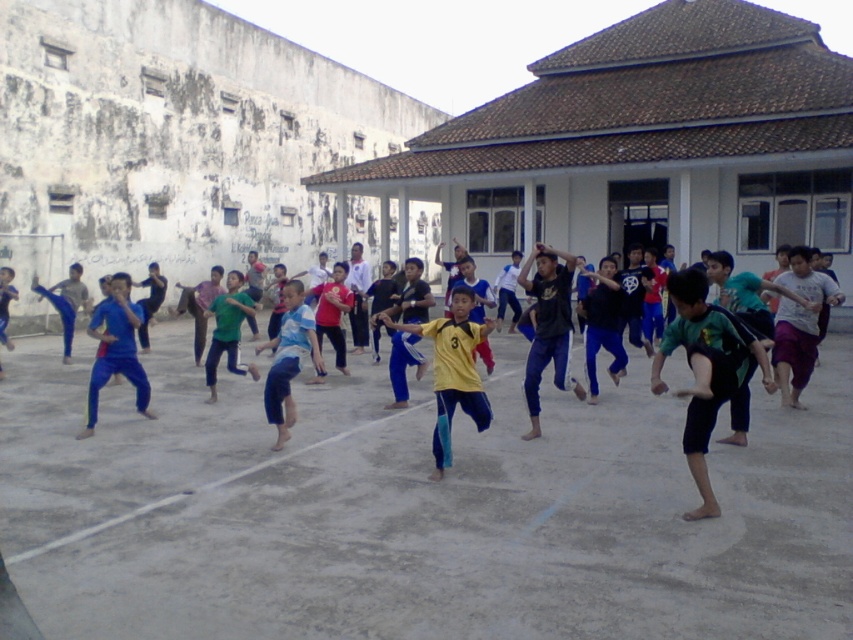
Question: Estimate the real-world distances between objects in this image. Which object is closer to the green fabric pants at center?

Choices:
 (A) blue fabric pants at center
 (B) yellow jersey at center

Answer: (A)

Question: Which is nearer to the green fabric pants at center?

Choices:
 (A) yellow jersey at center
 (B) blue fabric pants at center

Answer: (B)

Question: Is yellow jersey at center in front of blue fabric pants at center?

Choices:
 (A) yes
 (B) no

Answer: (A)

Question: Is blue fabric pants at center further to camera compared to green fabric pants at center?

Choices:
 (A) no
 (B) yes

Answer: (A)

Question: Can you confirm if yellow jersey at center is positioned to the left of blue fabric pants at center?

Choices:
 (A) no
 (B) yes

Answer: (A)

Question: Estimate the real-world distances between objects in this image. Which object is closer to the yellow jersey at center?

Choices:
 (A) green fabric pants at center
 (B) blue fabric pants at center

Answer: (B)